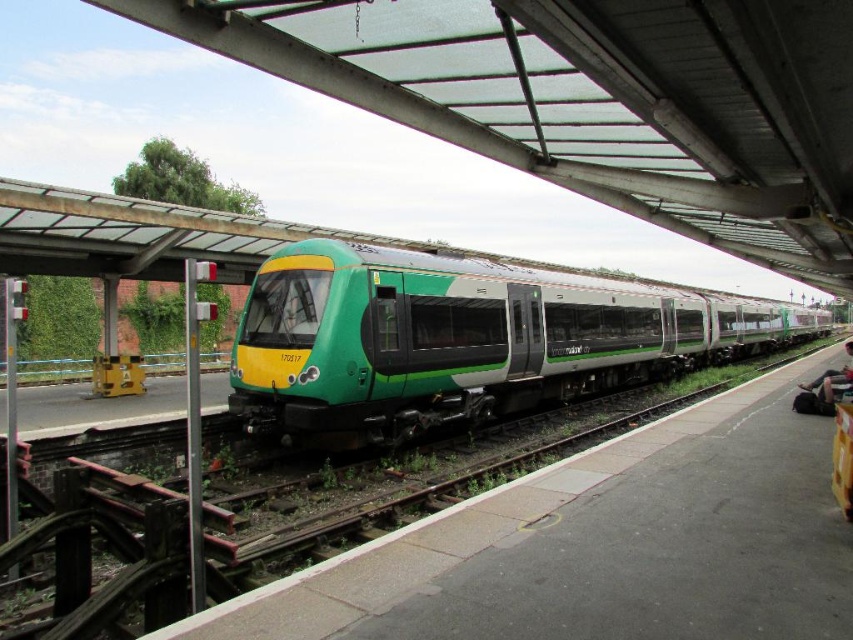
Who is positioned more to the left, green matte train at center or dark gray fabric bag at lower right?

Positioned to the left is green matte train at center.

At what (x,y) coordinates should I click in order to perform the action: click on green matte train at center. Please return your answer as a coordinate pair (x, y). The height and width of the screenshot is (640, 853). Looking at the image, I should click on (461, 339).

Find the location of a particular element. green matte train at center is located at coordinates (461, 339).